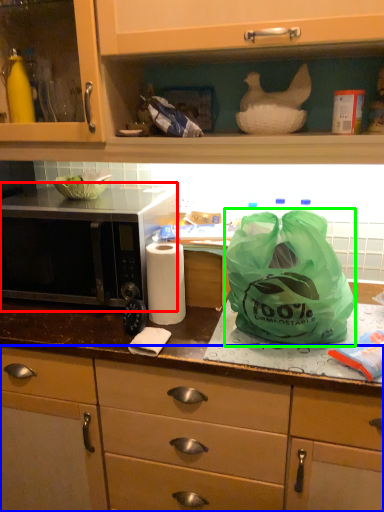
Question: Which object is positioned closest to microwave (highlighted by a red box)? Select from cabinetry (highlighted by a blue box) and plastic bag (highlighted by a green box).

Choices:
 (A) cabinetry
 (B) plastic bag

Answer: (A)